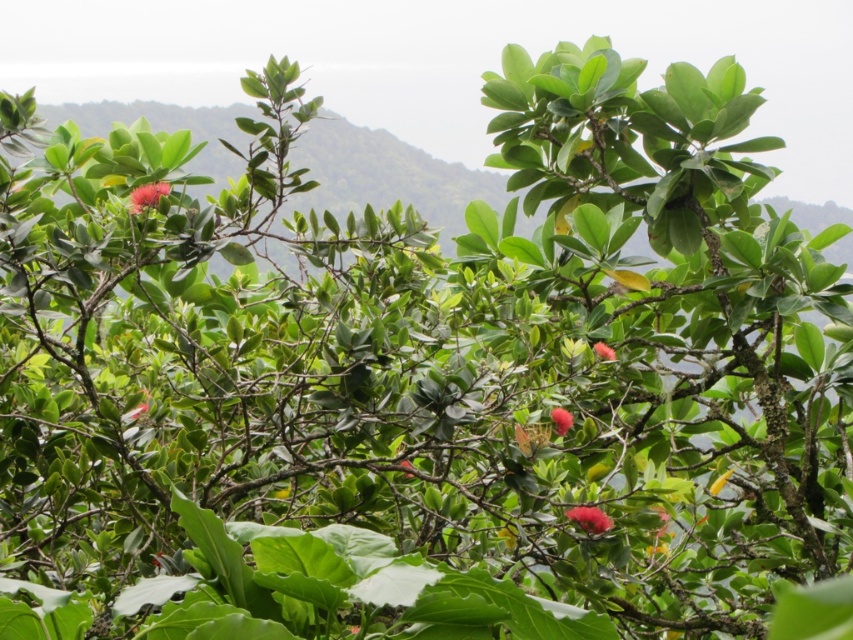
Who is more forward, (590, 515) or (407, 476)?

Point (590, 515) is more forward.

Consider the image. Who is more distant from viewer, (606, 524) or (403, 467)?

Positioned behind is point (403, 467).

Locate an element on the screen. The image size is (853, 640). vivid pink flower at center is located at coordinates (589, 518).

Is point (136, 211) positioned behind point (592, 344)?

No, (136, 211) is closer to viewer.

This screenshot has height=640, width=853. Describe the element at coordinates (148, 195) in the screenshot. I see `glossy red flower at upper left` at that location.

Describe the element at coordinates (148, 195) in the screenshot. I see `glossy red flower at upper left` at that location.

This screenshot has width=853, height=640. I want to click on glossy red flower at upper left, so click(148, 195).

Does red matte flower at center-right have a smaller size compared to smooth pink flower at center?

No, red matte flower at center-right is not smaller than smooth pink flower at center.

Between point (604, 358) and point (404, 472), which one is positioned in front?

Point (404, 472) is in front.

At what (x,y) coordinates should I click in order to perform the action: click on red matte flower at center-right. Please return your answer as a coordinate pair (x, y). The width and height of the screenshot is (853, 640). Looking at the image, I should click on (604, 349).